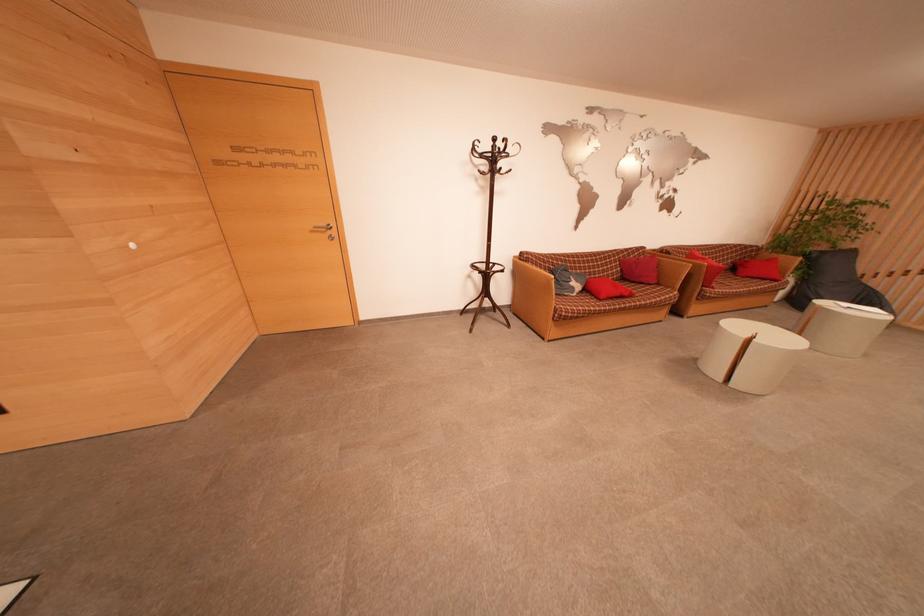
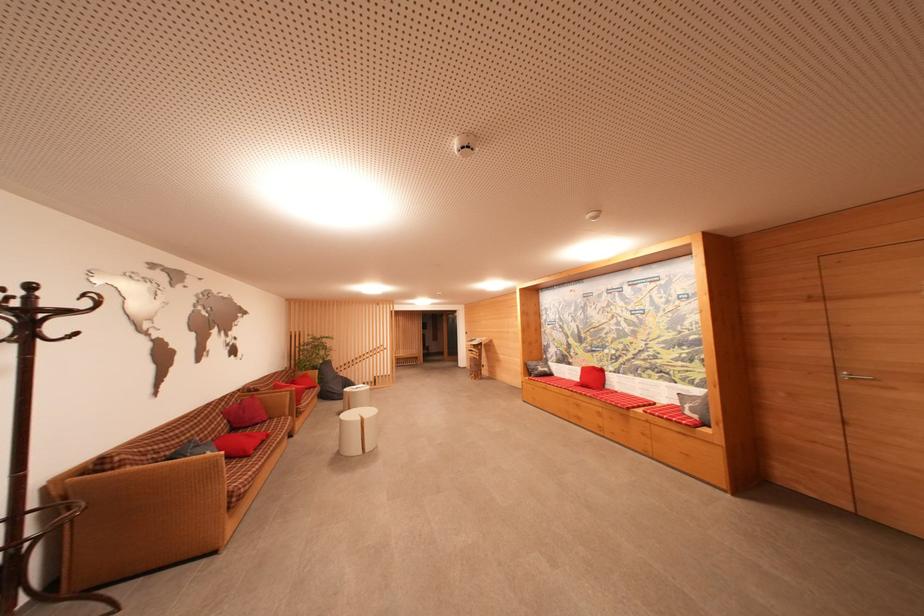
Find the pixel in the second image that matches point 825,251 in the first image.

(323, 365)